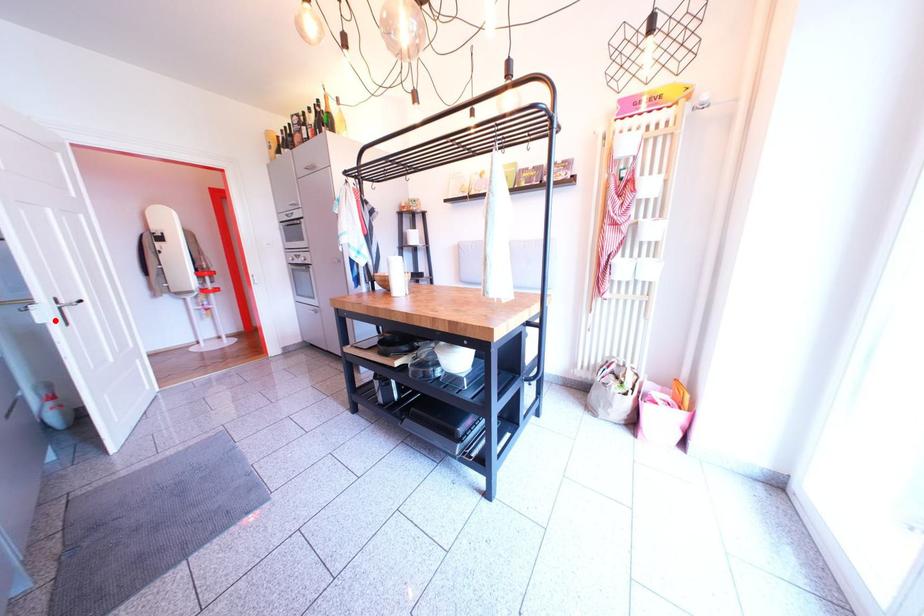
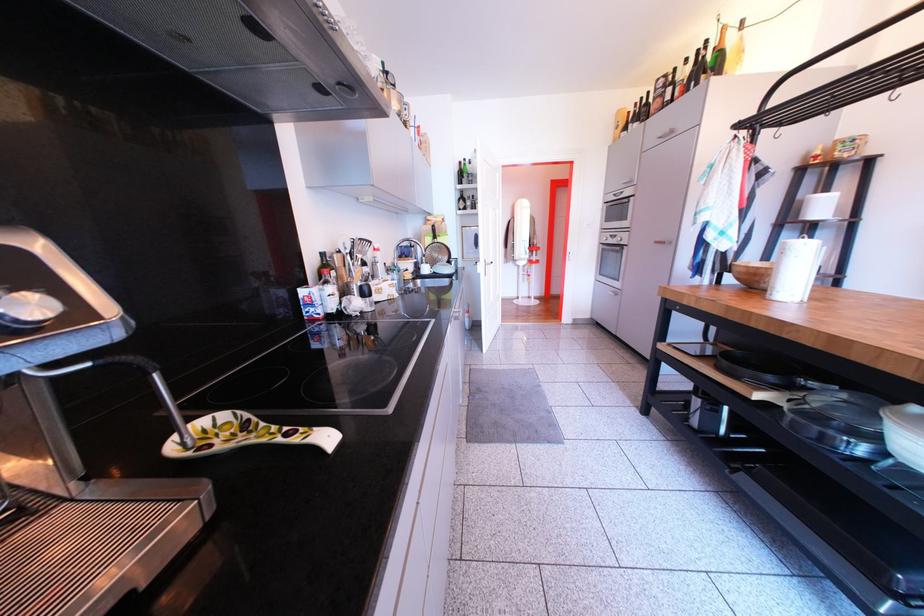
In the second image, find the point that corresponds to the highlighted location in the first image.

(492, 274)